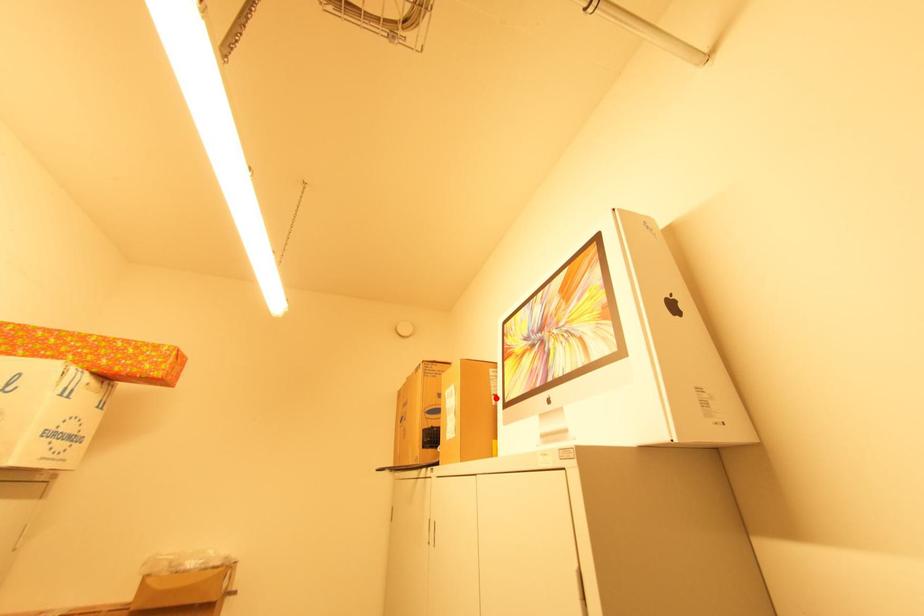
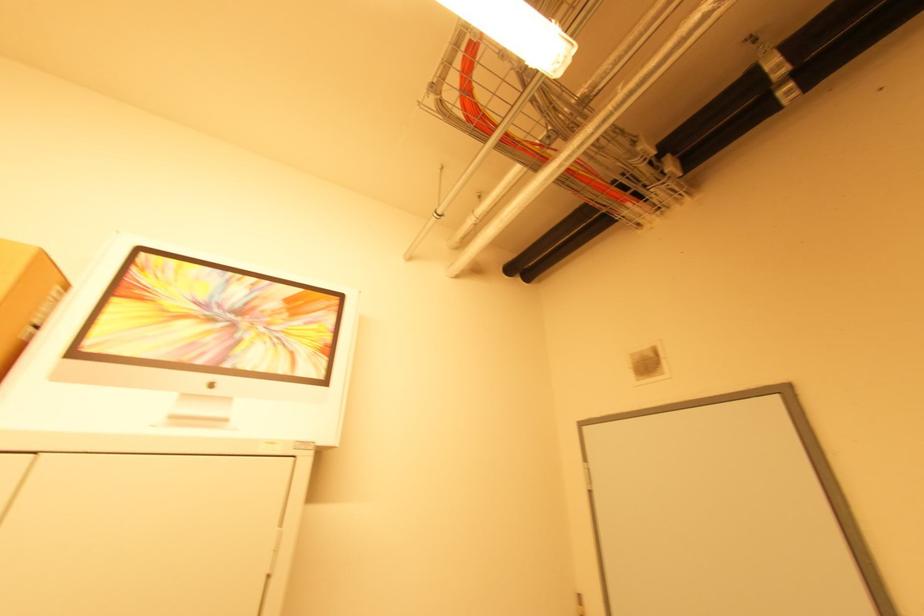
The point at the highlighted location is marked in the first image. Where is the corresponding point in the second image?

(32, 329)